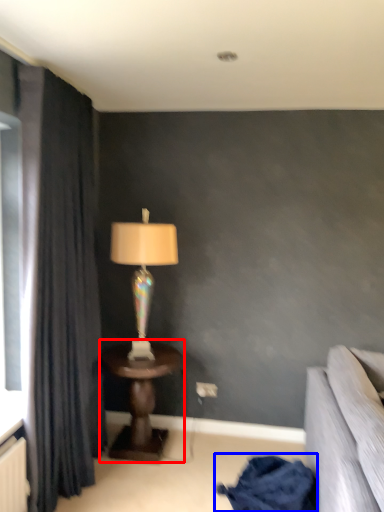
Question: Which object appears closest to the camera in this image, table (highlighted by a red box) or blanket (highlighted by a blue box)?

Choices:
 (A) table
 (B) blanket

Answer: (B)